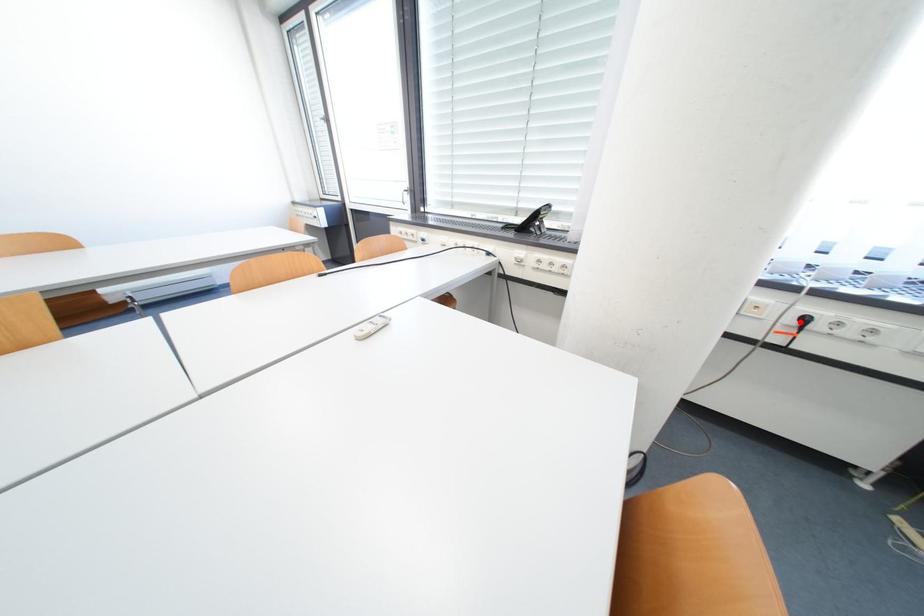
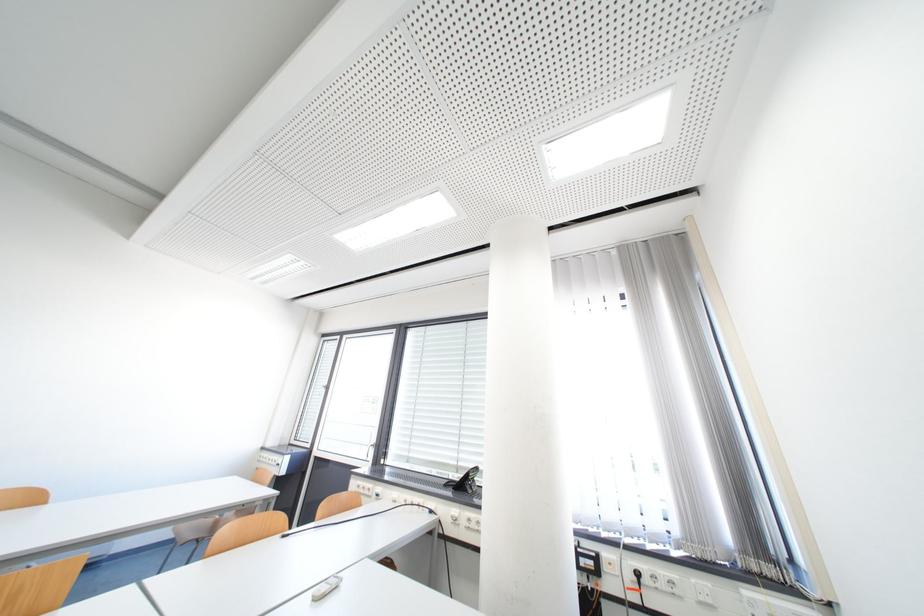
In the second image, find the point that corresponds to the highlighted location in the first image.

(639, 578)